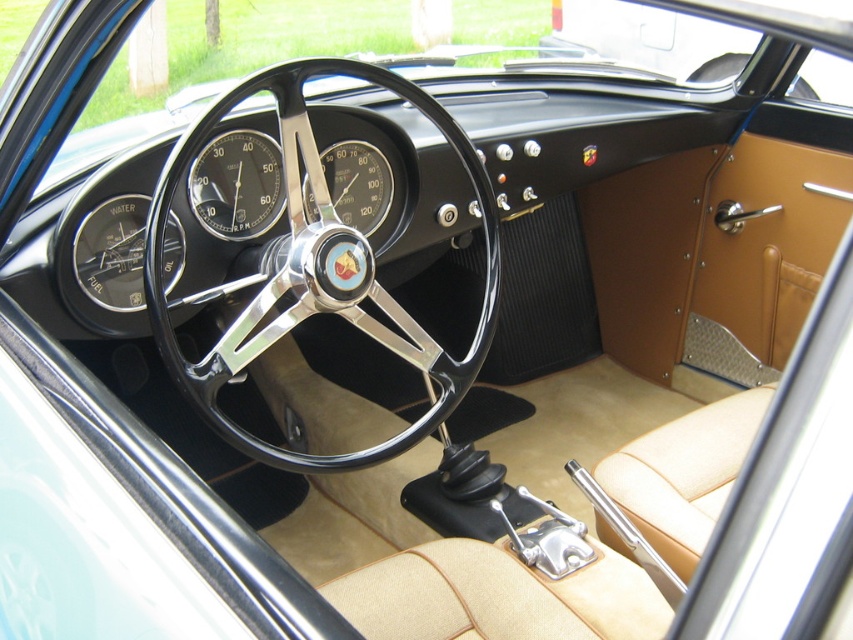
Is point (335, 243) positioned before point (340, 202)?

Yes, it is.

Between black chrome steering wheel at center and black rubber speedometer at center, which one appears on the right side from the viewer's perspective?

From the viewer's perspective, black chrome steering wheel at center appears more on the right side.

The width and height of the screenshot is (853, 640). Find the location of `black chrome steering wheel at center`. black chrome steering wheel at center is located at coordinates (318, 268).

You are a GUI agent. You are given a task and a screenshot of the screen. Output one action in this format:
    pyautogui.click(x=<x>, y=<y>)
    Task: Click on the black chrome steering wheel at center
    The image size is (853, 640).
    Given the screenshot: What is the action you would take?
    pyautogui.click(x=318, y=268)

Can you confirm if black chrome steering wheel at center is wider than matte black gauge at center?

Yes, black chrome steering wheel at center is wider than matte black gauge at center.

Locate an element on the screen. black chrome steering wheel at center is located at coordinates (318, 268).

Who is more forward, (279, 100) or (248, 163)?

Point (279, 100)

The image size is (853, 640). Identify the location of black chrome steering wheel at center. (318, 268).

Which is in front, point (260, 204) or point (376, 204)?

Point (260, 204)

What do you see at coordinates (236, 184) in the screenshot?
I see `matte black gauge at center` at bounding box center [236, 184].

Is point (221, 154) positioned before point (349, 168)?

Yes, it is in front of point (349, 168).

Find the location of a particular element. The width and height of the screenshot is (853, 640). matte black gauge at center is located at coordinates (236, 184).